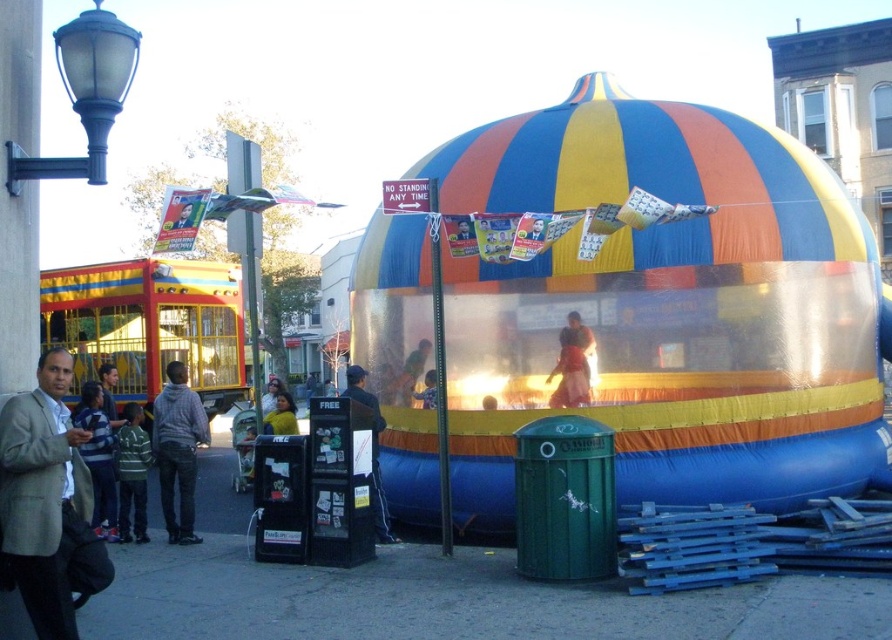
Question: Can you confirm if striped sweater at lower left is positioned above yellow shirt at center?

Choices:
 (A) no
 (B) yes

Answer: (A)

Question: Among these points, which one is nearest to the camera?

Choices:
 (A) (376, 509)
 (B) (285, 419)
 (C) (54, 356)
 (D) (142, 468)

Answer: (C)

Question: From the image, what is the correct spatial relationship of gray hoodie at left in relation to yellow shirt at center?

Choices:
 (A) left
 (B) right

Answer: (A)

Question: Estimate the real-world distances between objects in this image. Which object is closer to the gray hoodie at left?

Choices:
 (A) striped sweater at lower left
 (B) matte pink dress at center
 (C) smooth concrete pavement at lower center

Answer: (A)

Question: Which point is closer to the camera?

Choices:
 (A) (193, 481)
 (B) (246, 556)
 (C) (131, 460)

Answer: (B)

Question: Can you confirm if smooth concrete pavement at lower center is thinner than striped sweater at lower left?

Choices:
 (A) yes
 (B) no

Answer: (B)